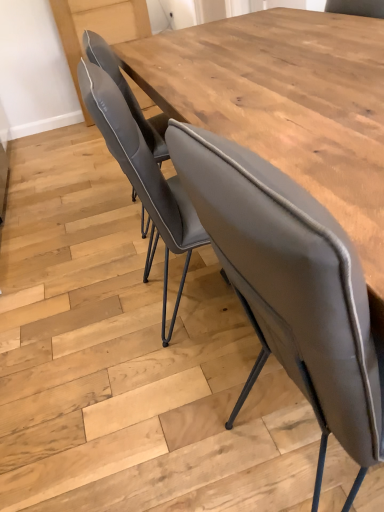
Identify the location of wooden table at center. Image resolution: width=384 pixels, height=512 pixels. (286, 103).

This screenshot has width=384, height=512. Describe the element at coordinates (286, 103) in the screenshot. I see `wooden table at center` at that location.

What do you see at coordinates (291, 288) in the screenshot? I see `matte gray chair at center` at bounding box center [291, 288].

Locate an element on the screen. matte gray chair at center is located at coordinates (x=291, y=288).

Find the location of a particular element. The height and width of the screenshot is (512, 384). wooden table at center is located at coordinates (286, 103).

Which is more to the left, matte gray chair at center or wooden table at center?

wooden table at center is more to the left.

Is matte gray chair at center positioned in front of wooden table at center?

Yes, the depth of matte gray chair at center is less than that of wooden table at center.

Is point (361, 348) closer to camera compared to point (354, 102)?

Yes, it is.

From the image's perspective, which is above, matte gray chair at center or wooden table at center?

wooden table at center appears higher in the image.

From a real-world perspective, is matte gray chair at center physically located above or below wooden table at center?

In terms of real-world spatial position, matte gray chair at center is above wooden table at center.

Considering the sizes of matte gray chair at center and wooden table at center in the image, is matte gray chair at center wider or thinner than wooden table at center?

Considering their sizes, matte gray chair at center looks broader than wooden table at center.

Is matte gray chair at center taller than wooden table at center?

Indeed, matte gray chair at center has a greater height compared to wooden table at center.

Looking at this image, can you confirm if matte gray chair at center is bigger than wooden table at center?

Yes, matte gray chair at center is bigger than wooden table at center.

Can wooden table at center be found inside matte gray chair at center?

No, wooden table at center is not surrounded by matte gray chair at center.

Consider the image. Can you see matte gray chair at center touching wooden table at center?

They are not placed beside each other.

Looking at this image, is matte gray chair at center facing towards wooden table at center?

No, matte gray chair at center is not aimed at wooden table at center.

Can you tell me how much matte gray chair at center and wooden table at center differ in facing direction?

matte gray chair at center and wooden table at center are facing 4.32 degrees away from each other.

This screenshot has width=384, height=512. In order to click on table on the left of the matte gray chair at center in this screenshot , I will do `click(286, 103)`.

Based on their positions, is wooden table at center located to the left or right of matte gray chair at center?

In the image, wooden table at center appears on the left side of matte gray chair at center.

Which is behind, wooden table at center or matte gray chair at center?

wooden table at center is further from the camera.

Does point (185, 71) come in front of point (350, 425)?

No, it is behind (350, 425).

From the image's perspective, which is below, wooden table at center or matte gray chair at center?

matte gray chair at center, from the image's perspective.

From a real-world perspective, between wooden table at center and matte gray chair at center, who is vertically lower?

From a 3D spatial view, wooden table at center is below.

In terms of width, does wooden table at center look wider or thinner when compared to matte gray chair at center?

Considering their sizes, wooden table at center looks slimmer than matte gray chair at center.

Considering the sizes of objects wooden table at center and matte gray chair at center in the image provided, who is shorter, wooden table at center or matte gray chair at center?

With less height is wooden table at center.

Considering the relative sizes of wooden table at center and matte gray chair at center in the image provided, is wooden table at center bigger than matte gray chair at center?

Incorrect, wooden table at center is not larger than matte gray chair at center.

Consider the image. Would you say wooden table at center is inside or outside matte gray chair at center?

wooden table at center is spatially situated outside matte gray chair at center.

Is wooden table at center in contact with matte gray chair at center?

There is a gap between wooden table at center and matte gray chair at center.

Could you tell me if wooden table at center is turned towards matte gray chair at center?

No, wooden table at center does not turn towards matte gray chair at center.

Measure the distance between wooden table at center and matte gray chair at center.

wooden table at center is 19.02 inches from matte gray chair at center.

Image resolution: width=384 pixels, height=512 pixels. I want to click on chair that is in front of the wooden table at center, so click(291, 288).

In the image, there is a wooden table at center. Where is `chair below it (from the image's perspective)`? chair below it (from the image's perspective) is located at coordinates (291, 288).

Identify the location of table lying behind the matte gray chair at center. This screenshot has width=384, height=512. (286, 103).